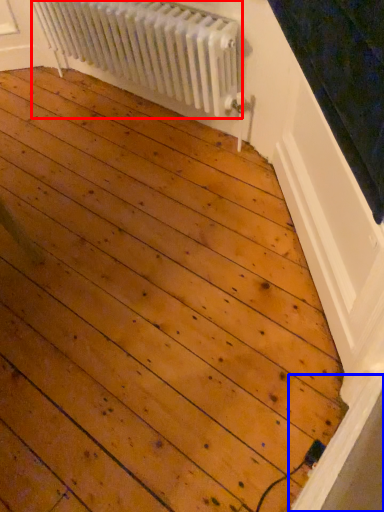
Question: Which object appears farthest to the camera in this image, radiator (highlighted by a red box) or window sill (highlighted by a blue box)?

Choices:
 (A) radiator
 (B) window sill

Answer: (A)